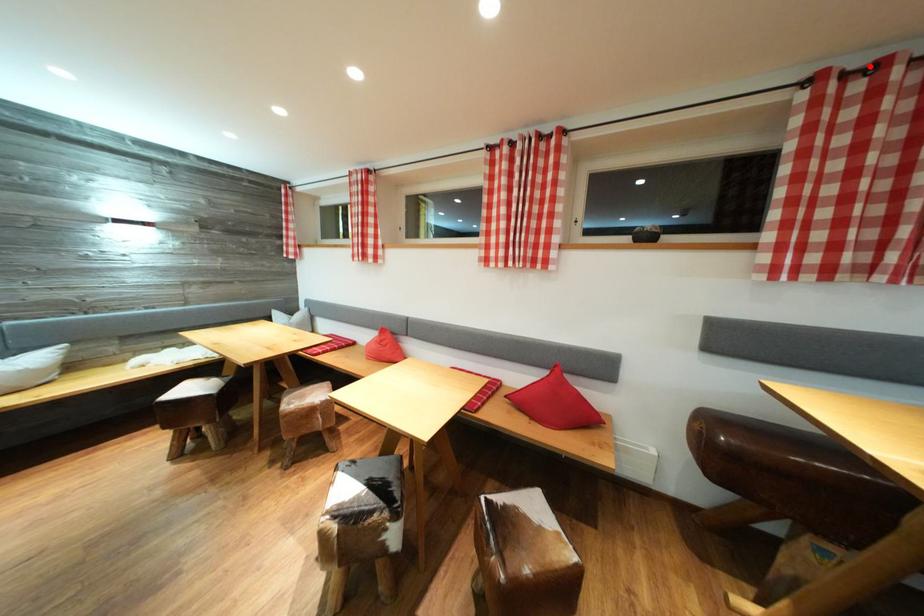
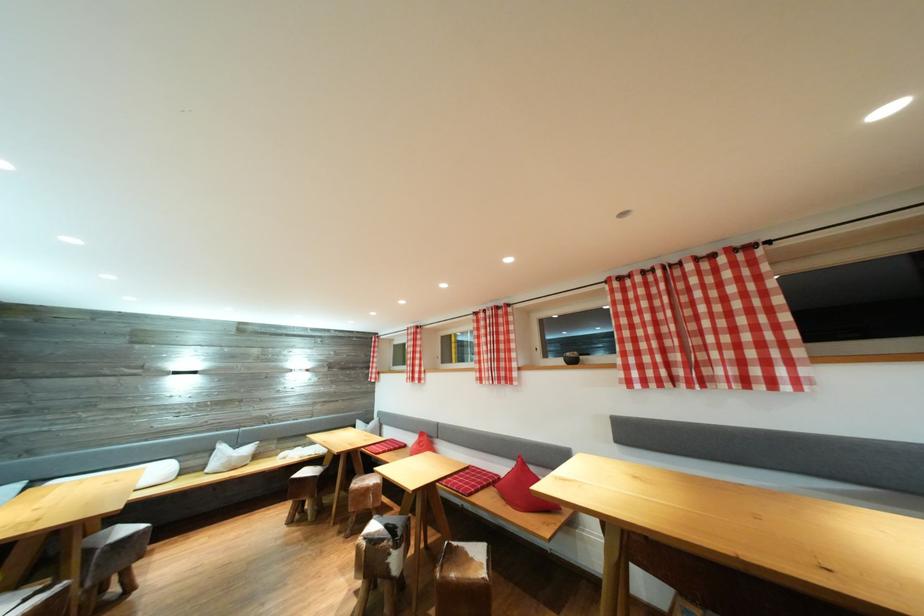
Question: I am providing you with two images of the same scene from different viewpoints. A red point is marked on the first image. Is the red point's position out of view in image 2?

Choices:
 (A) Yes
 (B) No

Answer: (B)